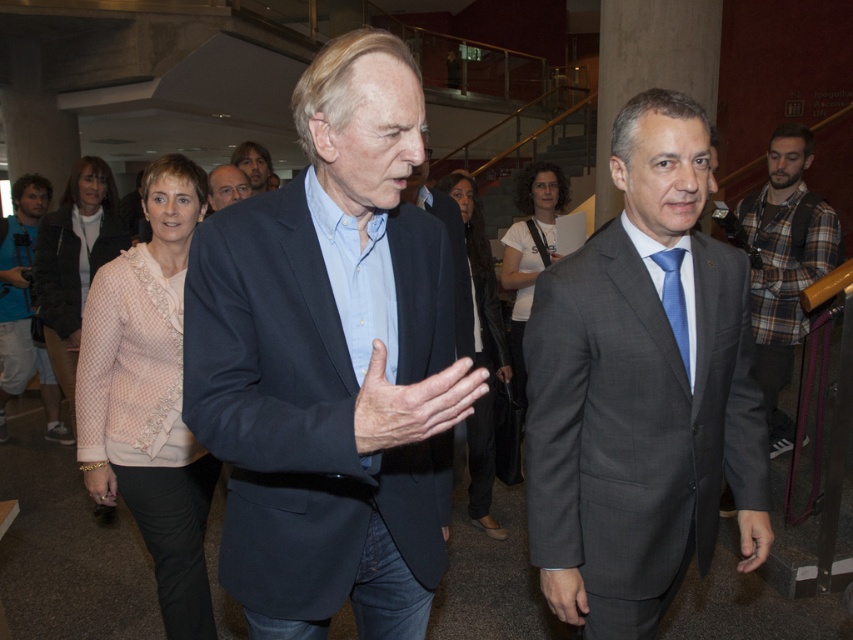
Is dark blue suit at center to the right of blue denim jeans at lower left from the viewer's perspective?

Yes, dark blue suit at center is to the right of blue denim jeans at lower left.

Where is `dark blue suit at center`? This screenshot has height=640, width=853. dark blue suit at center is located at coordinates (331, 364).

Where is `dark blue suit at center`? This screenshot has height=640, width=853. dark blue suit at center is located at coordinates (331, 364).

Who is taller, gray suit at center or blue textured tie at center?

gray suit at center

Describe the element at coordinates (641, 392) in the screenshot. The height and width of the screenshot is (640, 853). I see `gray suit at center` at that location.

Where is `gray suit at center`? gray suit at center is located at coordinates (641, 392).

Who is positioned more to the left, blue cotton shirt at center or light brown hair at upper center?

Result: From the viewer's perspective, light brown hair at upper center appears more on the left side.

Measure the distance between point (461, 312) and camera.

They are 2.26 meters apart.

Identify the location of blue cotton shirt at center. The image size is (853, 640). (450, 248).